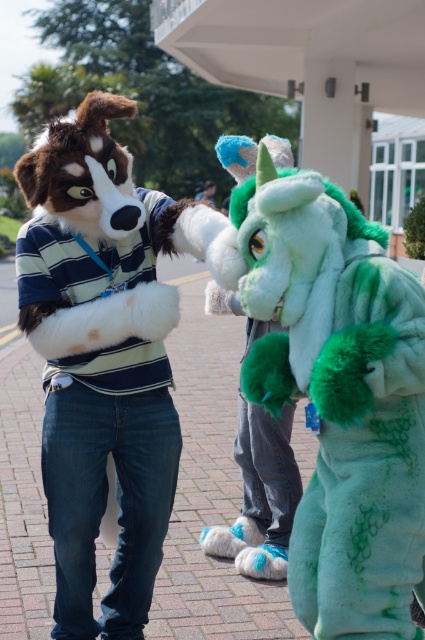
Can you confirm if green fuzzy dragon at center is positioned above fuzzy white dog at center?

No.

The height and width of the screenshot is (640, 425). I want to click on green fuzzy dragon at center, so click(x=333, y=384).

Between point (223, 298) and point (62, 529), which one is positioned in front?

Point (62, 529) is in front.

This screenshot has height=640, width=425. Find the location of `green fuzzy dragon at center`. green fuzzy dragon at center is located at coordinates (333, 384).